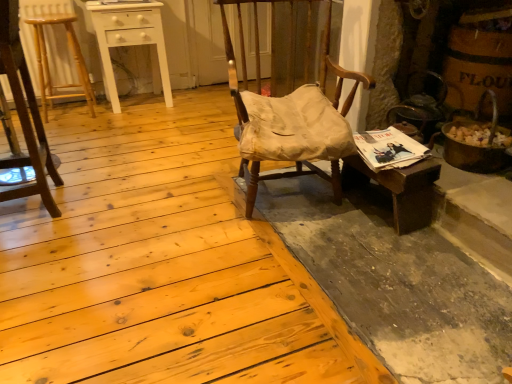
Where is `free space that is to the left of wooden chair with worn fabric cushion at center, the first chair in the right-to-left sequence`? The height and width of the screenshot is (384, 512). free space that is to the left of wooden chair with worn fabric cushion at center, the first chair in the right-to-left sequence is located at coordinates (170, 196).